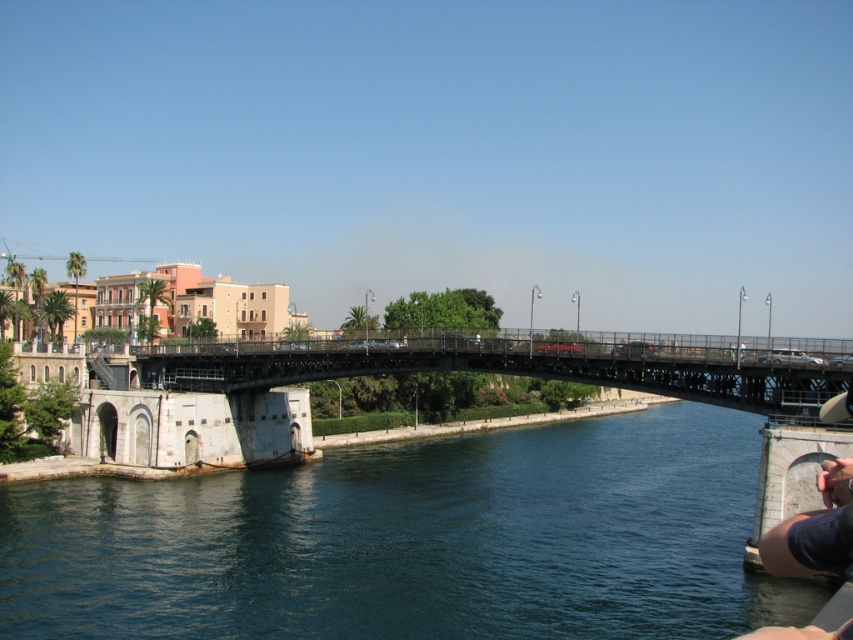
Between deep blue water at center and metallic bridge at center, which one has more height?

With more height is deep blue water at center.

In the scene shown: Who is more distant from viewer, (132, 540) or (248, 356)?

The point (248, 356) is behind.

In order to click on deep blue water at center in this screenshot , I will do `click(415, 540)`.